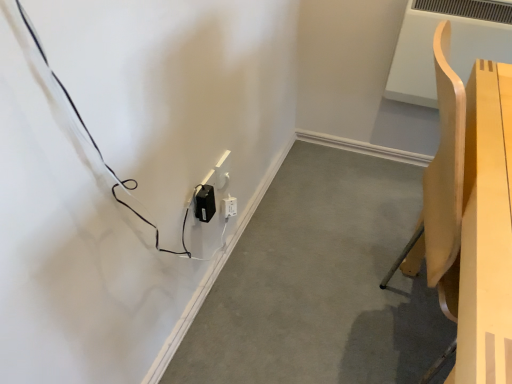
Question: Is black plastic power adapter at lower left to the right of white plastic electric outlet at center, arranged as the 2th electric outlet when viewed from the front, from the viewer's perspective?

Choices:
 (A) yes
 (B) no

Answer: (A)

Question: Is black plastic power adapter at lower left with white plastic electric outlet at center, which is the 1th electric outlet in back-to-front order?

Choices:
 (A) no
 (B) yes

Answer: (A)

Question: Can you confirm if black plastic power adapter at lower left is smaller than white plastic electric outlet at center, arranged as the 2th electric outlet when viewed from the front?

Choices:
 (A) yes
 (B) no

Answer: (B)

Question: From a real-world perspective, is black plastic power adapter at lower left on white plastic electric outlet at center, which is the 1th electric outlet in back-to-front order?

Choices:
 (A) yes
 (B) no

Answer: (B)

Question: From a real-world perspective, is black plastic power adapter at lower left located beneath white plastic electric outlet at center, arranged as the 2th electric outlet when viewed from the front?

Choices:
 (A) yes
 (B) no

Answer: (A)

Question: In terms of width, does black plastic power adapter at lower left look wider or thinner when compared to black plastic power adapter at lower center, the 1th electric outlet when ordered from front to back?

Choices:
 (A) wide
 (B) thin

Answer: (A)

Question: Would you say black plastic power adapter at lower left is to the left or to the right of black plastic power adapter at lower center, the second electric outlet when ordered from back to front, in the picture?

Choices:
 (A) right
 (B) left

Answer: (A)

Question: Based on their sizes in the image, would you say black plastic power adapter at lower left is bigger or smaller than black plastic power adapter at lower center, the 1th electric outlet when ordered from front to back?

Choices:
 (A) small
 (B) big

Answer: (B)

Question: Is black plastic power adapter at lower left spatially inside black plastic power adapter at lower center, the second electric outlet when ordered from back to front, or outside of it?

Choices:
 (A) inside
 (B) outside

Answer: (B)

Question: Considering the positions of white plastic electric outlet at center, which is the 1th electric outlet in back-to-front order, and black plastic power adapter at lower center, the second electric outlet when ordered from back to front, in the image, is white plastic electric outlet at center, which is the 1th electric outlet in back-to-front order, taller or shorter than black plastic power adapter at lower center, the second electric outlet when ordered from back to front,?

Choices:
 (A) short
 (B) tall

Answer: (B)

Question: Is point (222, 183) closer or farther from the camera than point (212, 208)?

Choices:
 (A) closer
 (B) farther

Answer: (B)

Question: Is white plastic electric outlet at center, arranged as the 2th electric outlet when viewed from the front, situated inside black plastic power adapter at lower center, the second electric outlet when ordered from back to front, or outside?

Choices:
 (A) inside
 (B) outside

Answer: (B)

Question: Relative to black plastic power adapter at lower center, the second electric outlet when ordered from back to front, is white plastic electric outlet at center, which is the 1th electric outlet in back-to-front order, in front or behind?

Choices:
 (A) front
 (B) behind

Answer: (B)

Question: Is light wood chair at right inside or outside of black plastic power adapter at lower left?

Choices:
 (A) inside
 (B) outside

Answer: (B)

Question: From a real-world perspective, is light wood chair at right above or below black plastic power adapter at lower left?

Choices:
 (A) above
 (B) below

Answer: (A)